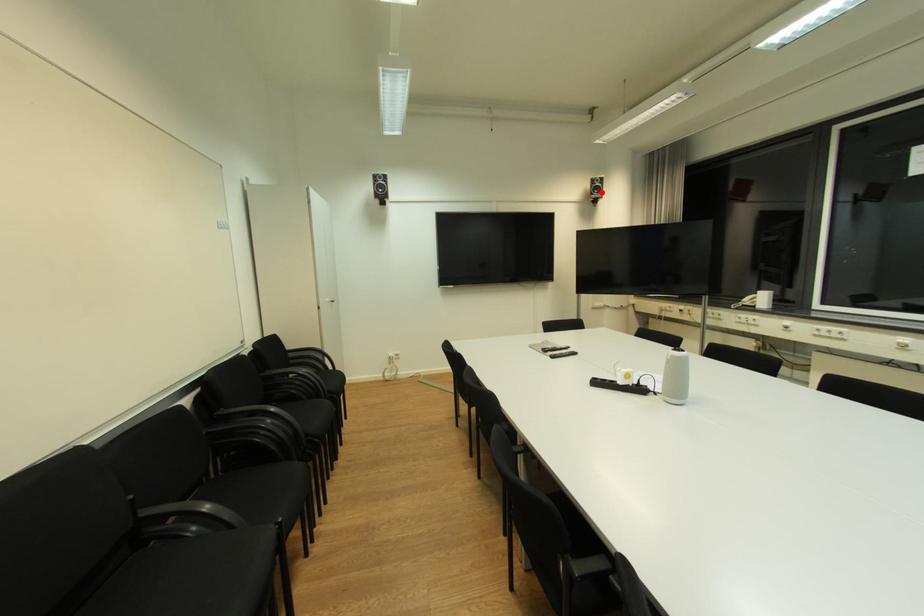
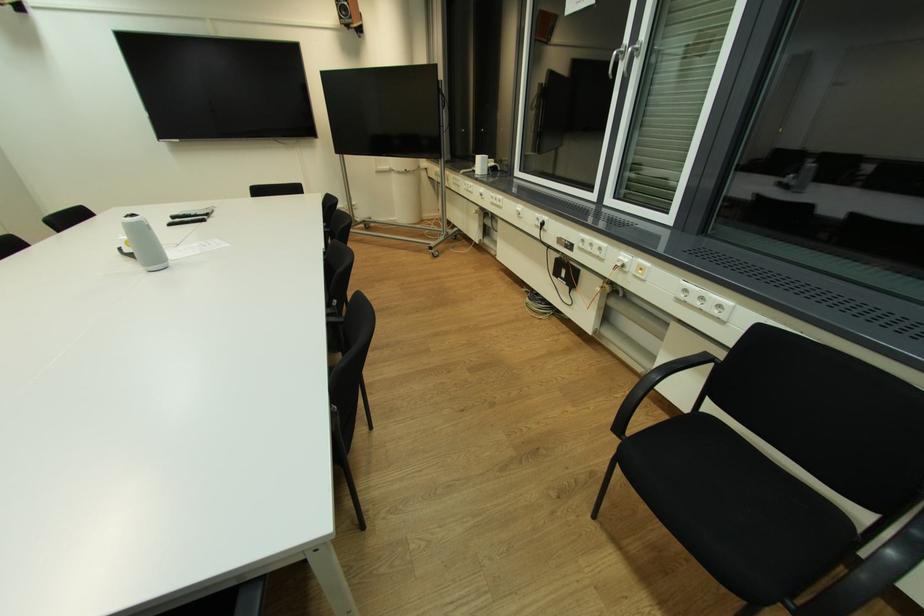
The point at the highlighted location is marked in the first image. Where is the corresponding point in the second image?

(349, 15)